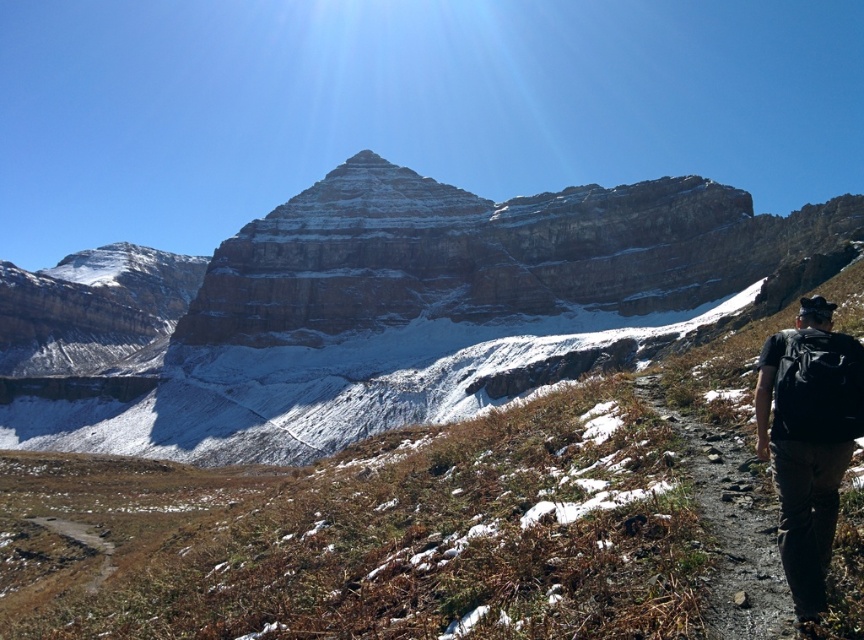
Question: Which of these objects is positioned closest to the dirt path at lower right?

Choices:
 (A) black fabric backpack at right
 (B) rugged stone mountain at center

Answer: (A)

Question: Which is farther from the rugged stone mountain at center?

Choices:
 (A) black fabric backpack at right
 (B) dirt path at lower right

Answer: (B)

Question: Is black fabric backpack at right positioned in front of dirt path at lower right?

Choices:
 (A) no
 (B) yes

Answer: (B)

Question: Can you confirm if black fabric backpack at right is positioned below dirt path at lower right?

Choices:
 (A) yes
 (B) no

Answer: (B)

Question: Considering the real-world distances, which object is closest to the black fabric backpack at right?

Choices:
 (A) rugged stone mountain at center
 (B) dirt path at lower right

Answer: (B)

Question: Can you confirm if rugged stone mountain at center is positioned to the left of dirt path at lower right?

Choices:
 (A) yes
 (B) no

Answer: (A)